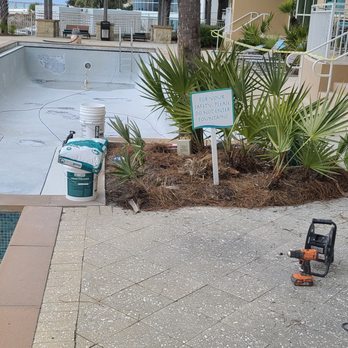
At what (x,y) coordinates should I click in order to perform the action: click on light brown tiles. Please return your answer as a coordinate pair (x, y). The height and width of the screenshot is (348, 348). Looking at the image, I should click on (180, 281).